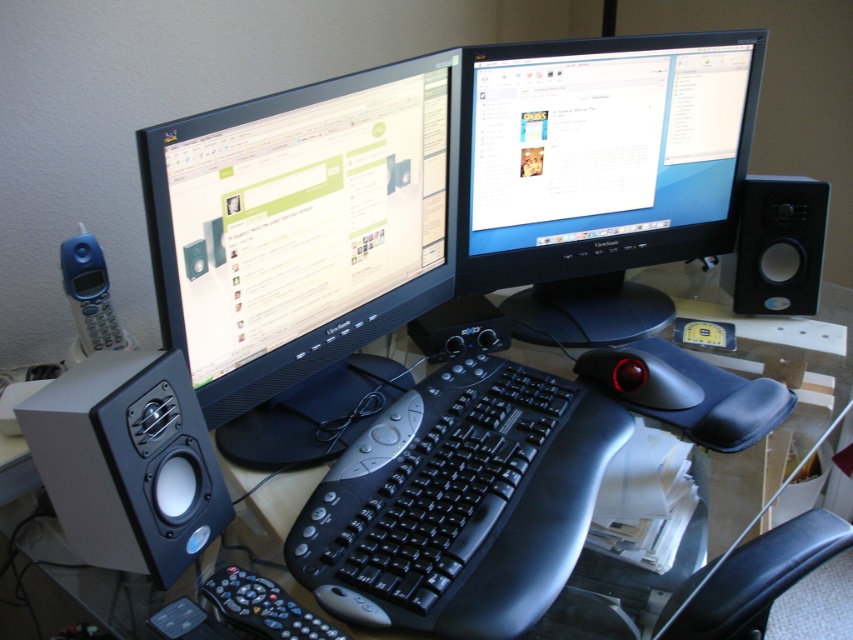
Who is lower down, matte black speaker at left or black matte speaker at right?

Positioned lower is matte black speaker at left.

Is matte black speaker at left taller than black matte speaker at right?

Yes.

Does point (77, 449) come behind point (781, 310)?

No, (77, 449) is in front of (781, 310).

Find the location of a particular element. matte black speaker at left is located at coordinates (128, 461).

You are a GUI agent. You are given a task and a screenshot of the screen. Output one action in this format:
    pyautogui.click(x=<x>, y=<y>)
    Task: Click on the matte black monitor at center
    The width and height of the screenshot is (853, 640).
    Given the screenshot: What is the action you would take?
    pyautogui.click(x=599, y=172)

Is matte black monitor at center thinner than blue plastic phone at left?

No, matte black monitor at center is not thinner than blue plastic phone at left.

Who is more distant from viewer, (596, 296) or (91, 292)?

Positioned behind is point (596, 296).

Find the location of `matte black monitor at center`. matte black monitor at center is located at coordinates (599, 172).

Is point (207, 541) farther from camera compared to point (709, 586)?

Yes, it is.

This screenshot has width=853, height=640. Find the location of `matte black speaker at left`. matte black speaker at left is located at coordinates (128, 461).